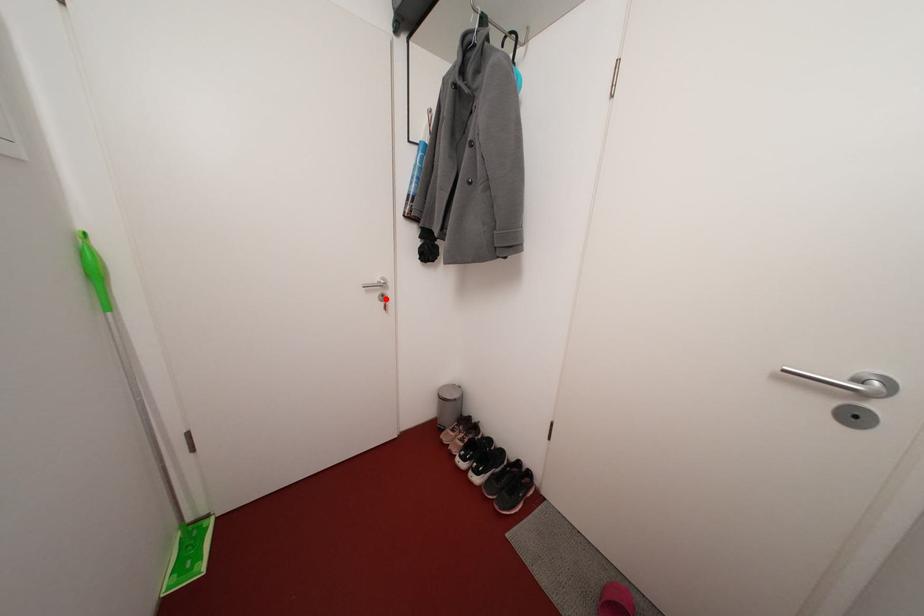
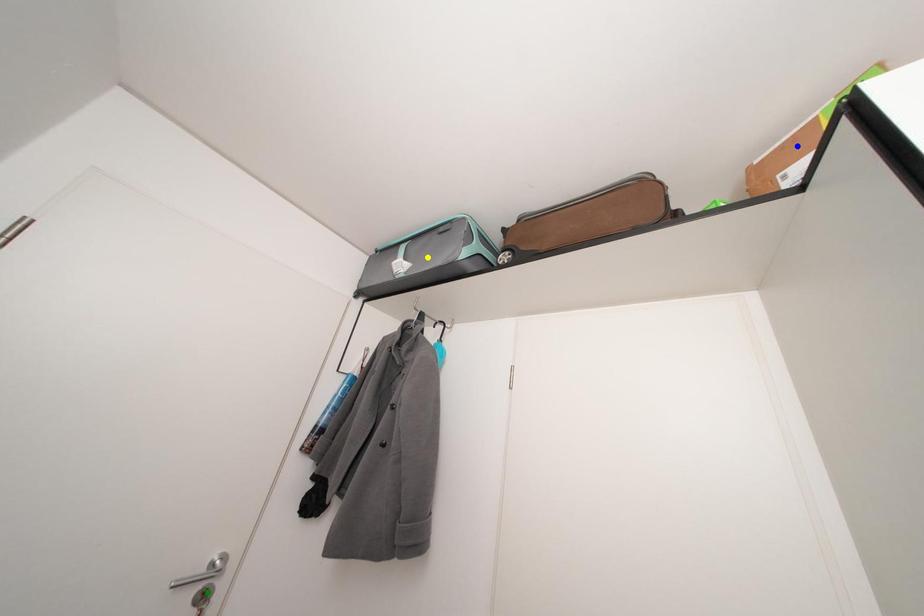
Question: I am providing you with two images of the same scene from different viewpoints. A red point is marked on the first image. You are given multiple points on the second image. In image 2, which mark is for the same physical point as the one in image 1?

Choices:
 (A) yellow point
 (B) blue point
 (C) green point

Answer: (C)